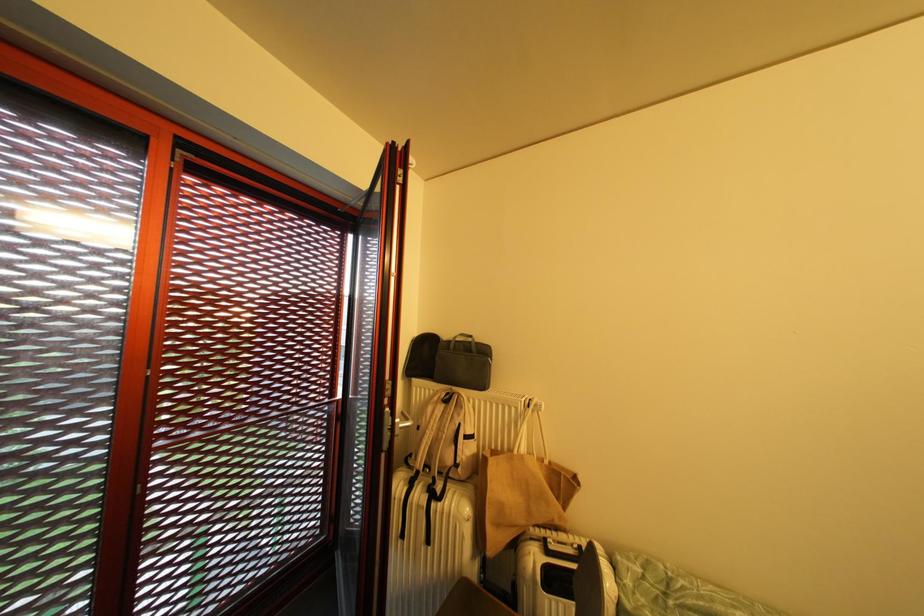
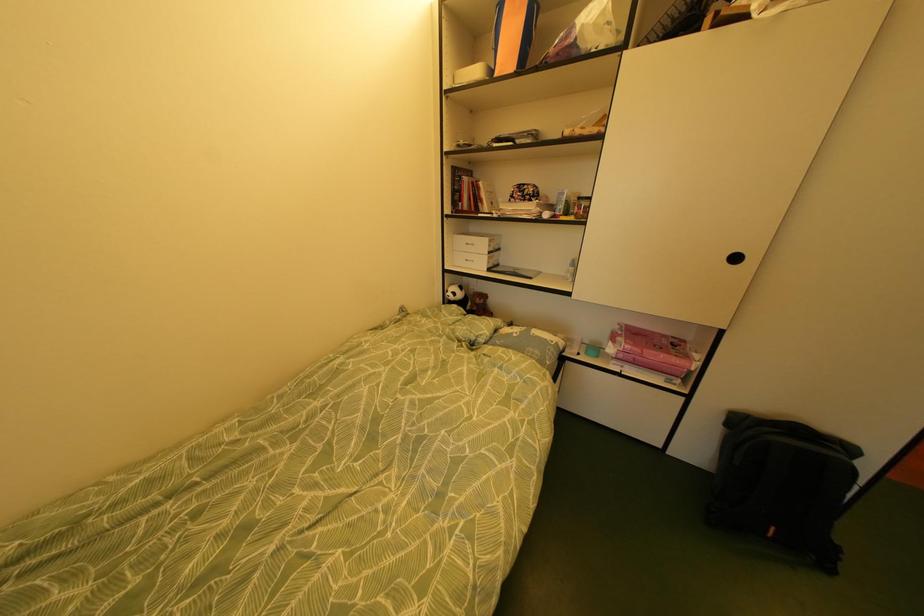
First-person continuous shooting, in which direction is the camera rotating?

The rotation direction of the camera is right-down.